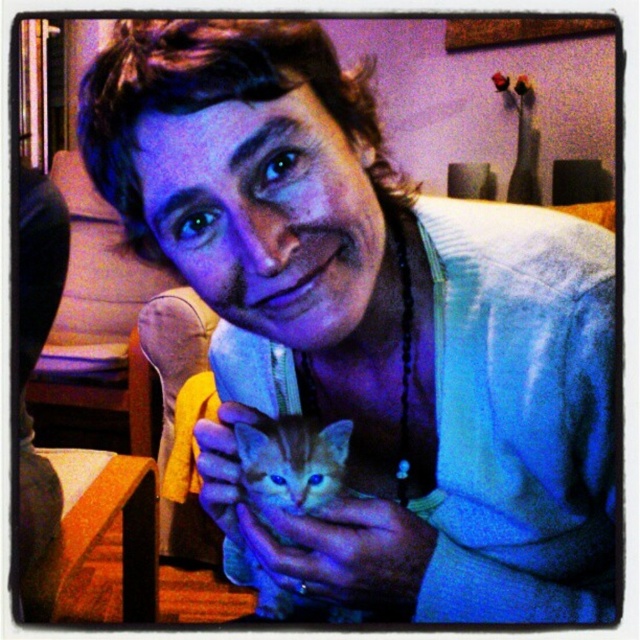
You are a robotic arm trying to grasp an object. You see the matte skin hand at lower center and the fuzzy orange cat at center. Which object has a larger width that could be easier to grasp?

The matte skin hand at lower center might be wider than fuzzy orange cat at center, so it could be easier to grasp.

You are a photographer trying to capture a close shot of the fuzzy orange cat at center. You notice the matte skin hand at lower center is blocking part of the cat. Can you adjust your position to avoid the hand while still keeping the cat in frame?

The matte skin hand at lower center is not as tall as the fuzzy orange cat at center, so moving the camera slightly upward or tilting it downward could allow you to avoid the hand while keeping the cat visible.

You are a photographer trying to capture the perfect shot of the scene. You want to focus on the matte skin hand at lower center. Based on its position, what coordinates should you adjust your camera to aim for?

The matte skin hand at lower center is located at coordinates point (344,552), so you should adjust your camera to aim for those coordinates to focus on it.